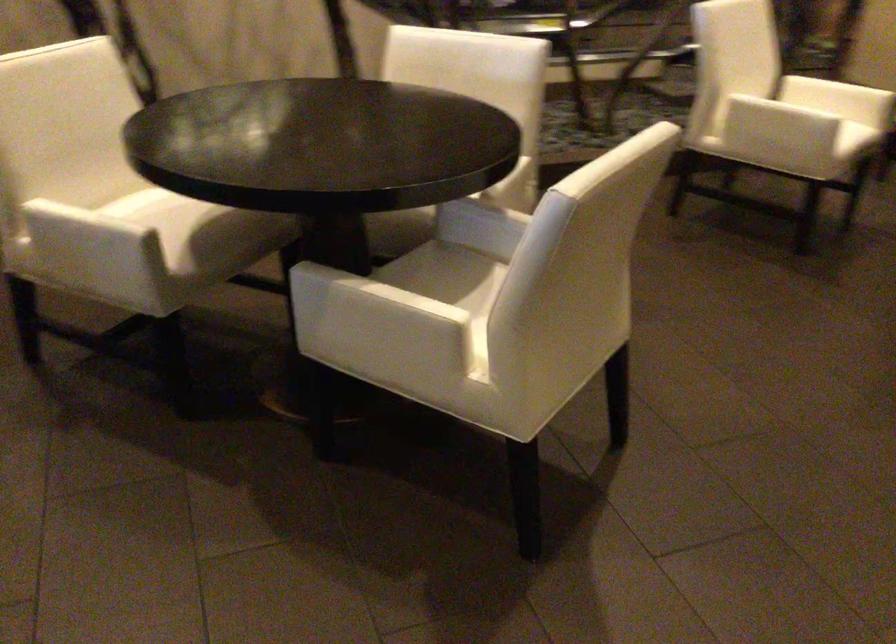
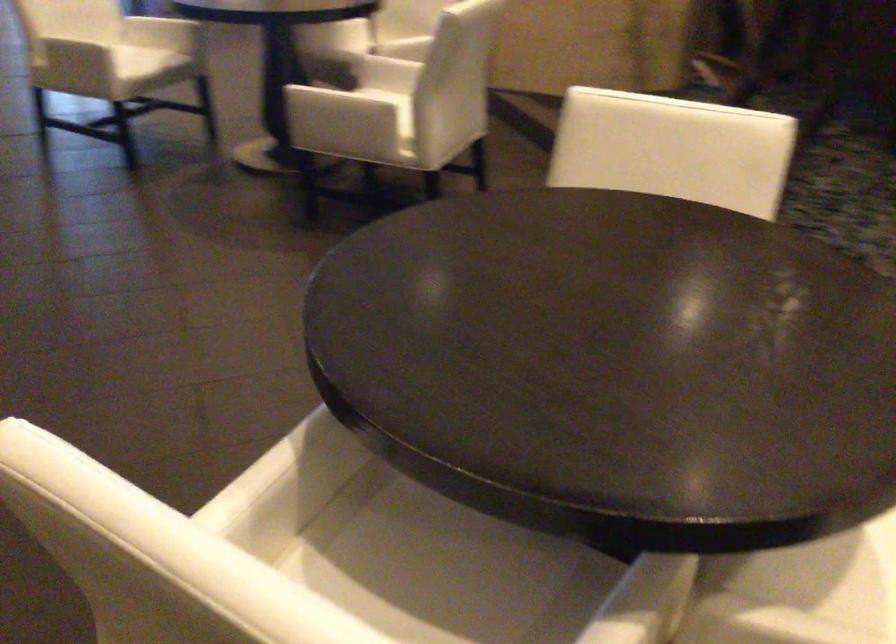
In the second image, find the point that corresponds to point (71, 84) in the first image.

(673, 149)